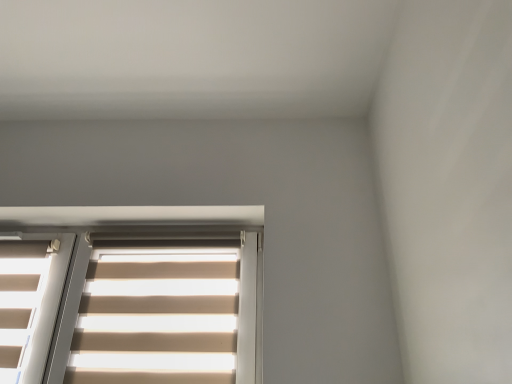
Question: Should I look upward or downward to see beige fabric blind at lower left?

Choices:
 (A) up
 (B) down

Answer: (B)